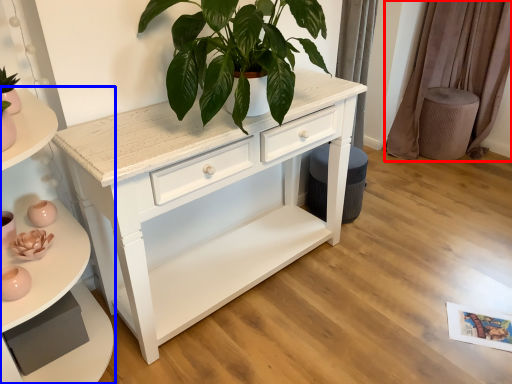
Question: Among these objects, which one is nearest to the camera, curtain (highlighted by a red box) or shelf (highlighted by a blue box)?

Choices:
 (A) curtain
 (B) shelf

Answer: (B)